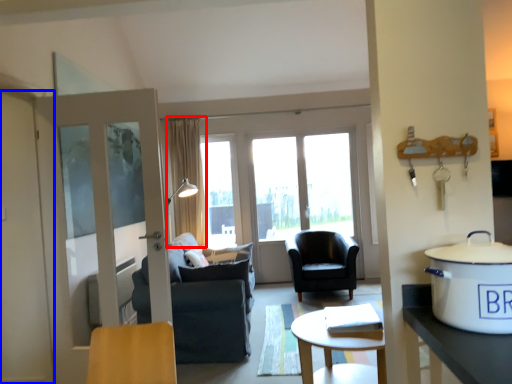
Question: Which object is closer to the camera taking this photo, curtain (highlighted by a red box) or screen door (highlighted by a blue box)?

Choices:
 (A) curtain
 (B) screen door

Answer: (B)